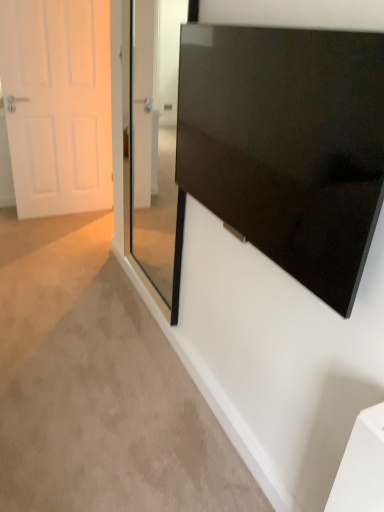
Identify the location of glossy black screen at upper right. click(287, 144).

Consider the image. Which is further, (220, 127) or (151, 39)?

The point (151, 39) is farther from the camera.

Is glossy black screen at upper right completely or partially outside of transparent glass door at center?

glossy black screen at upper right lies outside transparent glass door at center's area.

Is glossy black screen at upper right turned away from transparent glass door at center?

No, glossy black screen at upper right's orientation is not away from transparent glass door at center.

Is glossy black screen at upper right in front of or behind transparent glass door at center in the image?

glossy black screen at upper right is in front of transparent glass door at center.

Considering the sizes of objects white matte door at left and glossy black screen at upper right in the image provided, who is wider, white matte door at left or glossy black screen at upper right?

Wider between the two is white matte door at left.

Between white matte door at left and glossy black screen at upper right, which one has larger size?

With larger size is white matte door at left.

How different are the orientations of white matte door at left and glossy black screen at upper right in degrees?

The facing directions of white matte door at left and glossy black screen at upper right are 92.5 degrees apart.

Can you confirm if white matte door at left is positioned to the right of glossy black screen at upper right?

No.

Based on the photo, how far apart are glossy black screen at upper right and white matte door at left?

glossy black screen at upper right and white matte door at left are 2.17 meters apart from each other.

Is point (190, 172) less distant than point (94, 42)?

That is True.

Based on the photo, relative to white matte door at left, is glossy black screen at upper right in front or behind?

glossy black screen at upper right is in front of white matte door at left.

From a real-world perspective, is glossy black screen at upper right on white matte door at left?

Yes.

Is glossy black screen at upper right at the back of transparent glass door at center?

No, glossy black screen at upper right is not at the back of transparent glass door at center.

Looking at this image, which is in front, transparent glass door at center or glossy black screen at upper right?

glossy black screen at upper right.

From the picture: Choose the correct answer: Is transparent glass door at center inside glossy black screen at upper right or outside it?

transparent glass door at center is not inside glossy black screen at upper right, it's outside.

Is transparent glass door at center smaller than glossy black screen at upper right?

Incorrect, transparent glass door at center is not smaller in size than glossy black screen at upper right.

Between white matte door at left and transparent glass door at center, which one has smaller size?

Smaller between the two is transparent glass door at center.

From a real-world perspective, is white matte door at left positioned above or below transparent glass door at center?

white matte door at left is situated lower than transparent glass door at center in the real world.

Is white matte door at left turned away from transparent glass door at center?

white matte door at left does not have its back to transparent glass door at center.

Which is in front, white matte door at left or transparent glass door at center?

transparent glass door at center is closer to the camera.

How many degrees apart are the facing directions of transparent glass door at center and white matte door at left?

They differ by 93.6 degrees in their facing directions.

From the image's perspective, would you say transparent glass door at center is positioned over white matte door at left?

Incorrect, from the image's perspective, transparent glass door at center is lower than white matte door at left.

Does transparent glass door at center lie in front of white matte door at left?

Yes.

What are the coordinates of `glass door below the glossy black screen at upper right (from a real-world perspective)` in the screenshot? It's located at (155, 149).

The image size is (384, 512). I want to click on screen located above the white matte door at left (from a real-world perspective), so click(287, 144).

Considering their positions, is white matte door at left positioned further to glossy black screen at upper right than transparent glass door at center?

Among the two, white matte door at left is located further to glossy black screen at upper right.

From the image, which object appears to be nearer to white matte door at left, transparent glass door at center or glossy black screen at upper right?

Among the two, transparent glass door at center is located nearer to white matte door at left.

In the scene shown: Estimate the real-world distances between objects in this image. Which object is further from glossy black screen at upper right, transparent glass door at center or white matte door at left?

The object further to glossy black screen at upper right is white matte door at left.

Which object lies further to the anchor point transparent glass door at center, glossy black screen at upper right or white matte door at left?

Based on the image, glossy black screen at upper right appears to be further to transparent glass door at center.

Which object lies further to the anchor point white matte door at left, glossy black screen at upper right or transparent glass door at center?

glossy black screen at upper right is further to white matte door at left.

Which object lies nearer to the anchor point transparent glass door at center, white matte door at left or glossy black screen at upper right?

Based on the image, white matte door at left appears to be nearer to transparent glass door at center.

At what (x,y) coordinates should I click in order to perform the action: click on glass door positioned between glossy black screen at upper right and white matte door at left from near to far. Please return your answer as a coordinate pair (x, y). The height and width of the screenshot is (512, 384). Looking at the image, I should click on (155, 149).